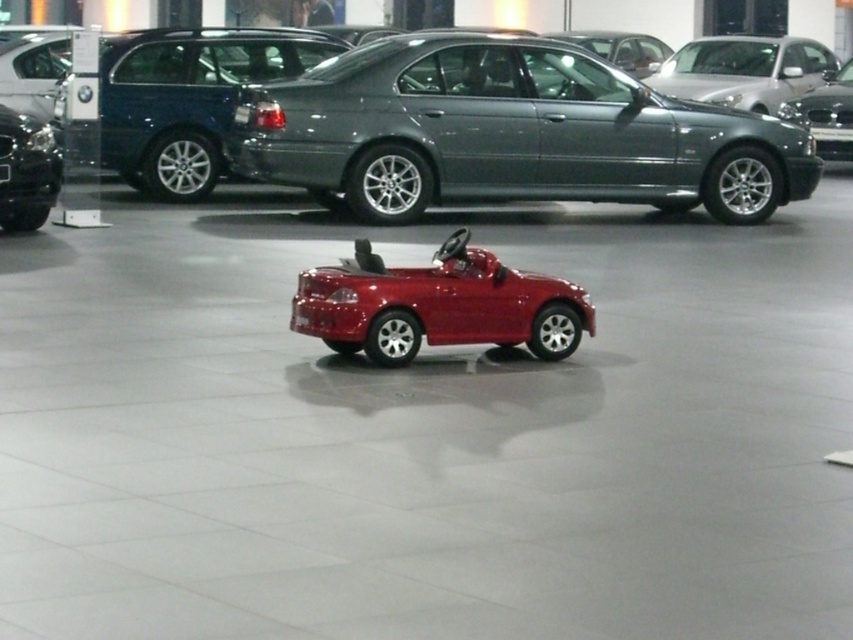
You are a delivery person who needs to place a large package between the metallic gray sedan at center and the shiny red toy car at center. The package requires 20 feet of space. Is there enough space between them?

The metallic gray sedan at center is 19.76 feet away from the shiny red toy car at center, so there is not enough space to place the package between them since it requires 20 feet of space.

Consider the image. You are a child visiting the car showroom and see the shiny red toy car at center and the shiny black car at left. Which car is closer to the entrance of the showroom?

The shiny black car at left is closer to the entrance because the shiny red toy car at center is positioned on its right side, implying it is further away from the entrance.